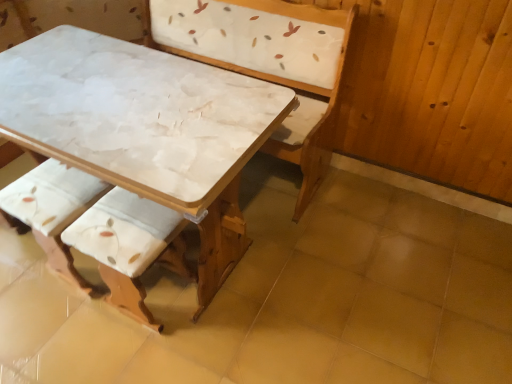
At what (x,y) coordinates should I click in order to perform the action: click on empty space that is ontop of white fabric cushion at lower left, which is the 2th armchair from right to left (from a real-world perspective). Please return your answer as a coordinate pair (x, y). The width and height of the screenshot is (512, 384). Looking at the image, I should click on (52, 187).